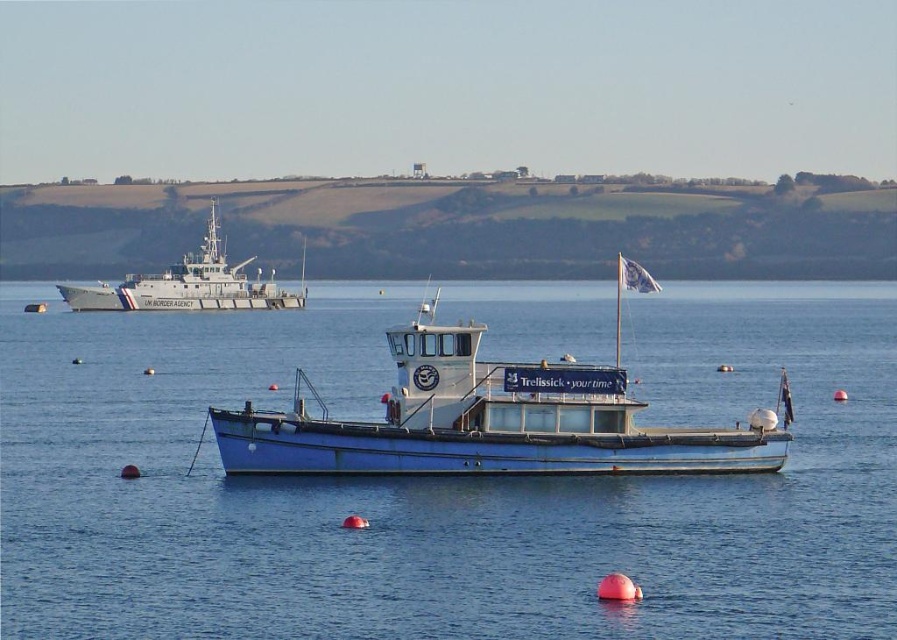
Question: Which object is the farthest from the blue matte boat at center?

Choices:
 (A) gray metallic ship at upper left
 (B) blue metallic boat at center

Answer: (A)

Question: Which object is farther from the camera taking this photo?

Choices:
 (A) blue metallic boat at center
 (B) gray metallic ship at upper left

Answer: (B)

Question: In this image, where is blue matte boat at center located relative to gray metallic ship at upper left?

Choices:
 (A) right
 (B) left

Answer: (A)

Question: Can you confirm if blue metallic boat at center is thinner than gray metallic ship at upper left?

Choices:
 (A) no
 (B) yes

Answer: (A)

Question: Based on their relative distances, which object is nearer to the blue metallic boat at center?

Choices:
 (A) gray metallic ship at upper left
 (B) blue matte boat at center

Answer: (B)

Question: Considering the relative positions of blue metallic boat at center and gray metallic ship at upper left in the image provided, where is blue metallic boat at center located with respect to gray metallic ship at upper left?

Choices:
 (A) left
 (B) right

Answer: (B)